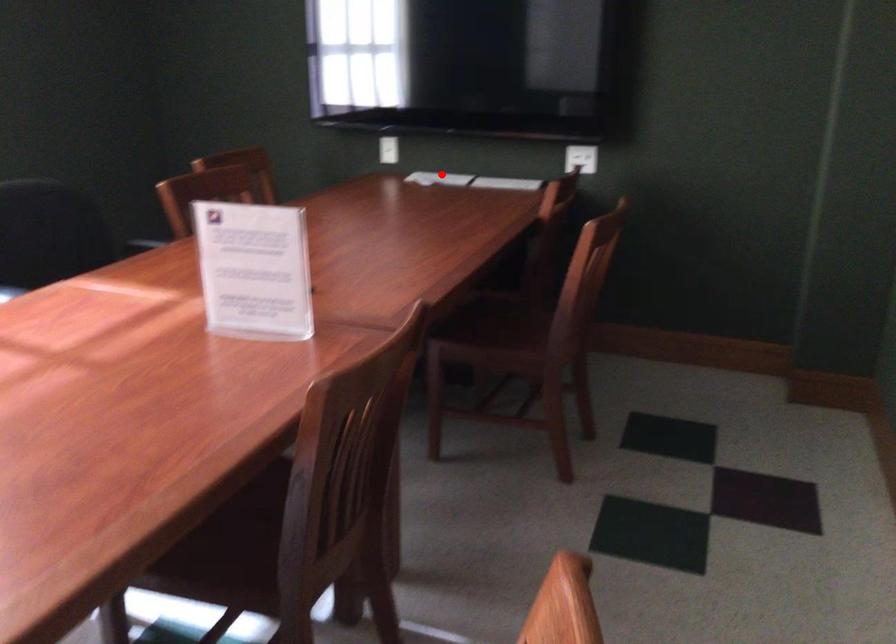
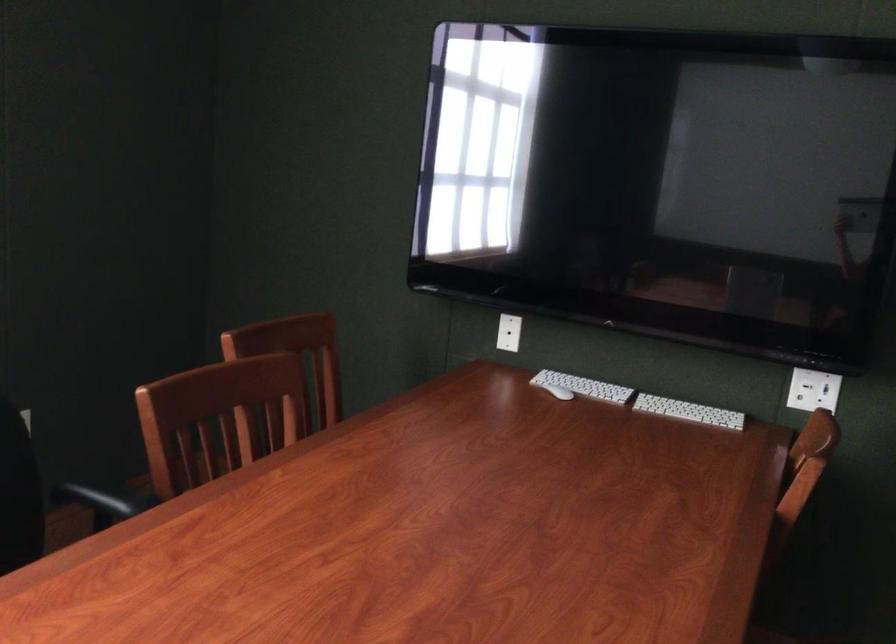
Question: A red point is marked in image1. In image2, is the corresponding 3D point closer to the camera or farther? Reply with the corresponding letter.

Choices:
 (A) The corresponding 3D point is closer.
 (B) The corresponding 3D point is farther.

Answer: (A)